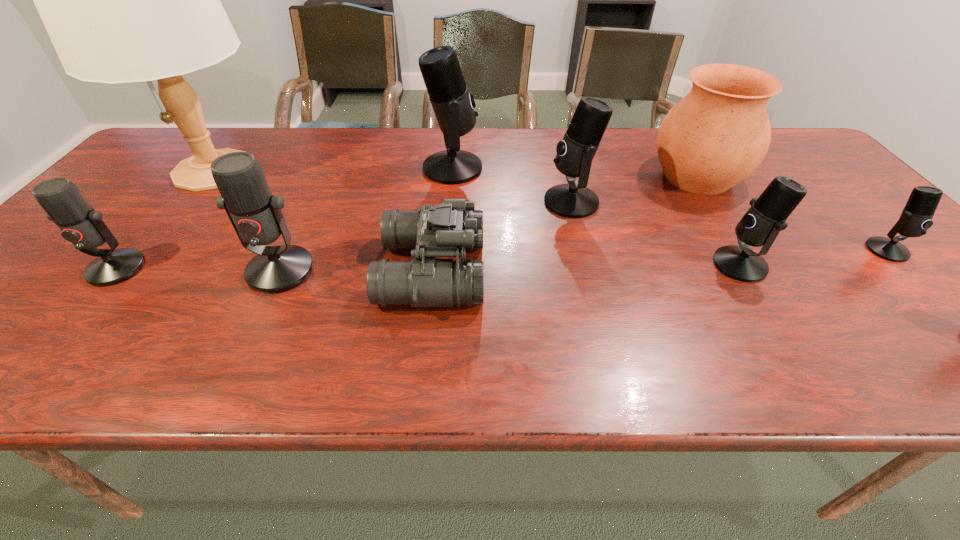
The width and height of the screenshot is (960, 540). I want to click on beige table lamp, so tap(123, 0).

Locate an element on the screen. table lamp is located at coordinates (123, 0).

Where is `the leftmost black microphone`? The width and height of the screenshot is (960, 540). the leftmost black microphone is located at coordinates (453, 105).

This screenshot has width=960, height=540. I want to click on the farthest black microphone, so click(x=453, y=105).

At what (x,y) coordinates should I click in order to perform the action: click on pottery. Please return your answer as a coordinate pair (x, y). Looking at the image, I should click on (719, 133).

Find the location of `the third smallest black microphone`. the third smallest black microphone is located at coordinates (575, 152).

You are a GUI agent. You are given a task and a screenshot of the screen. Output one action in this format:
    pyautogui.click(x=<x>, y=<y>)
    Task: Click on the second farthest microphone
    The height and width of the screenshot is (540, 960).
    Given the screenshot: What is the action you would take?
    pyautogui.click(x=575, y=152)

Locate an element on the screen. This screenshot has height=540, width=960. the right red microphone is located at coordinates (256, 215).

Identify the location of the fifth microphone from right to left. The width and height of the screenshot is (960, 540). (256, 215).

In order to click on the third black microphone from left to right in this screenshot , I will do `click(761, 224)`.